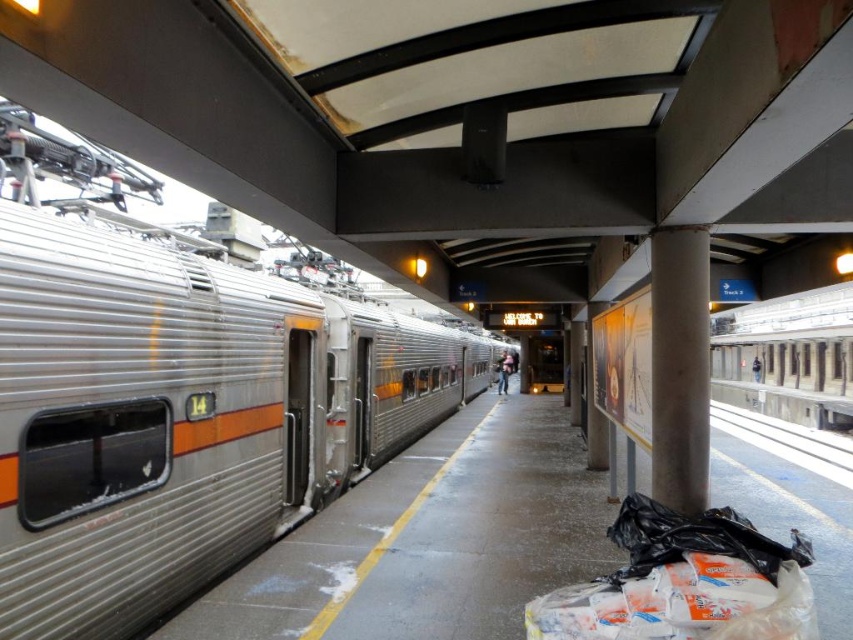
Which is in front, point (219, 285) or point (498, 356)?

Point (219, 285) is more forward.

What are the coordinates of `silver metallic train at left` in the screenshot? It's located at (183, 417).

Which is in front, point (338, 346) or point (511, 356)?

Point (338, 346) is more forward.

Locate an element on the screen. This screenshot has width=853, height=640. silver metallic train at left is located at coordinates (183, 417).

Which is above, silver metallic train at left or gray metallic train track at lower right?

Positioned higher is silver metallic train at left.

Which of these two, silver metallic train at left or gray metallic train track at lower right, stands taller?

gray metallic train track at lower right

Is point (13, 212) positioned after point (709, 412)?

No, it is not.

At what (x,y) coordinates should I click in order to perform the action: click on silver metallic train at left. Please return your answer as a coordinate pair (x, y). This screenshot has height=640, width=853. Looking at the image, I should click on (183, 417).

Between gray metallic train track at lower right and denim jacket at center, which one is positioned higher?

denim jacket at center is above.

Is gray metallic train track at lower right to the right of denim jacket at center from the viewer's perspective?

Indeed, gray metallic train track at lower right is positioned on the right side of denim jacket at center.

Between point (746, 433) and point (512, 360), which one is positioned in front?

Point (746, 433)

Find the location of `gray metallic train track at lower right`. gray metallic train track at lower right is located at coordinates (788, 440).